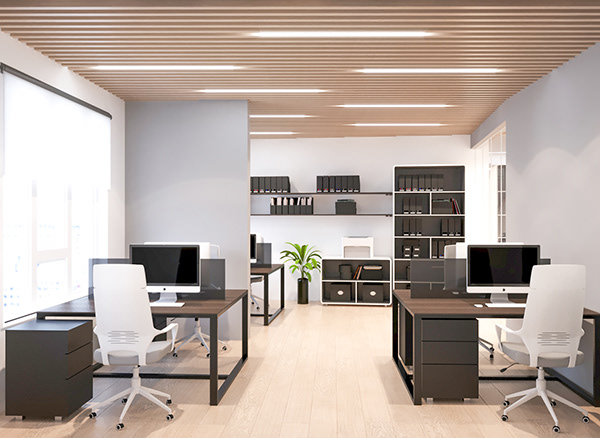
Locate an element on the screen. This screenshot has height=438, width=600. plant is located at coordinates (302, 251).